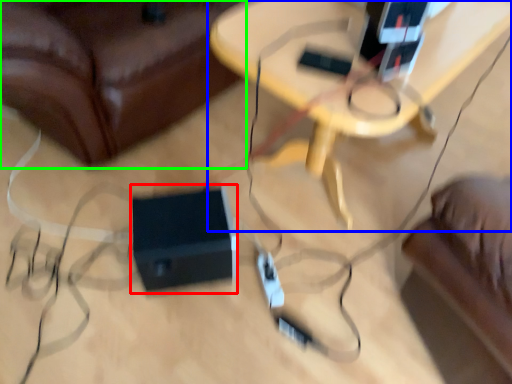
Question: Based on their relative distances, which object is nearer to speaker (highlighted by a red box)? Choose from table (highlighted by a blue box) and furniture (highlighted by a green box).

Choices:
 (A) table
 (B) furniture

Answer: (B)